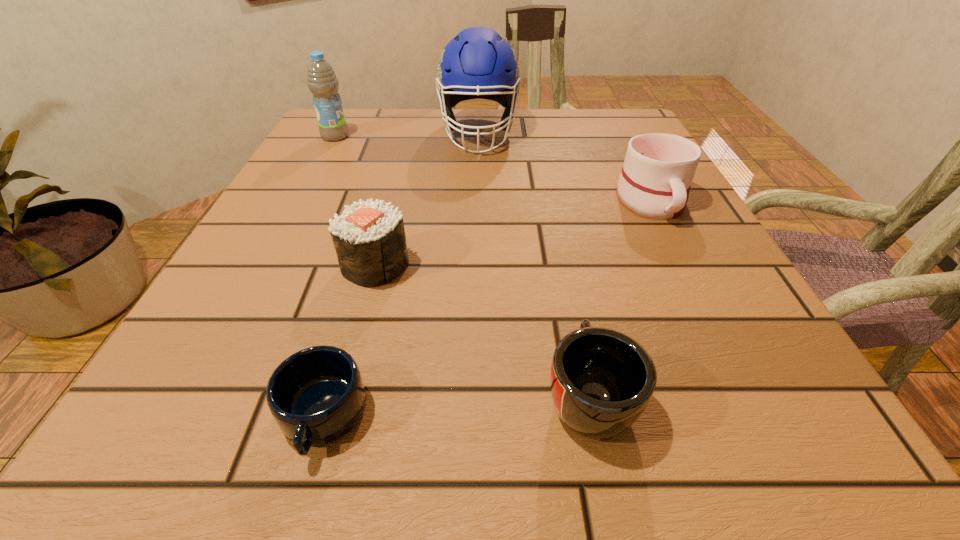
Locate which mug is the second closest to the third nearest object. Please provide its 2D coordinates. Your answer should be formatted as a tuple, i.e. [(x, y)], where the tuple contains the x and y coordinates of a point satisfying the conditions above.

[(602, 380)]

Find the location of a particular element. Image resolution: width=960 pixels, height=540 pixels. mug that is the closest to the tallest object is located at coordinates (658, 170).

I want to click on vacant space that satisfies the following two spatial constraints: 1. on the front side of the sushi; 2. on the right side of the leftmost object, so click(267, 265).

Locate an element on the screen. This screenshot has width=960, height=540. vacant space that satisfies the following two spatial constraints: 1. on the front side of the fourth farthest object; 2. on the left side of the second tallest object is located at coordinates (267, 265).